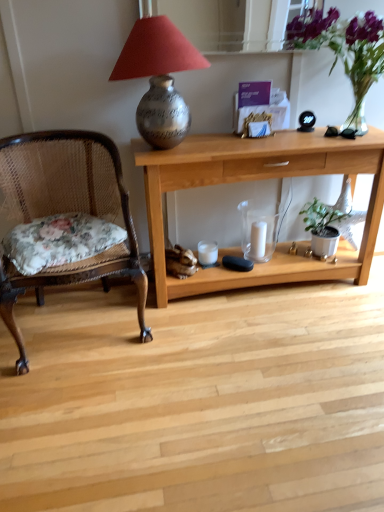
Image resolution: width=384 pixels, height=512 pixels. What are the coordinates of `free space in front of woven wood chair with floral cushion at left` in the screenshot? It's located at (84, 407).